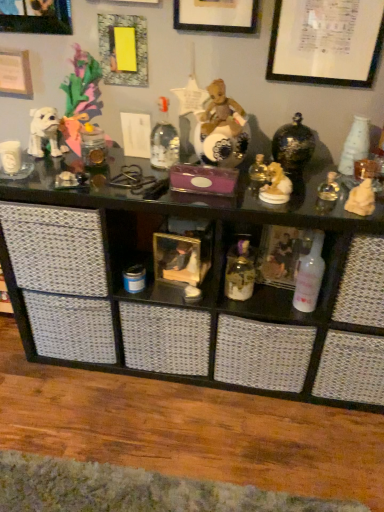
Question: Looking at the image, does white paper at upper left, the 5th picture frame from the right, seem bigger or smaller compared to white glossy bottle at center-right?

Choices:
 (A) big
 (B) small

Answer: (B)

Question: Considering the relative positions of white paper at upper left, the 5th picture frame from the right, and white glossy bottle at center-right in the image provided, is white paper at upper left, the 5th picture frame from the right, to the left or to the right of white glossy bottle at center-right?

Choices:
 (A) right
 (B) left

Answer: (B)

Question: Which is farther from the translucent glass jar at center?

Choices:
 (A) white glossy bottle at center-right
 (B) wooden framed picture at center, which is counted as the 1th shelf, starting from the left
 (C) brushed metal picture frame at upper left, the fourth picture frame when ordered from right to left
 (D) gold ceramic dog at upper right, the 1th toy positioned from the left
 (E) yellow paper at upper left, which is the third picture frame in right-to-left order

Answer: (C)

Question: Based on their relative distances, which object is farther from the brushed metal picture frame at upper left, the fourth picture frame when ordered from right to left?

Choices:
 (A) white paper at upper left, the 1th picture frame in the left-to-right sequence
 (B) white glossy bottle at center-right
 (C) black glass shelf at upper center, positioned as the second shelf in left-to-right order
 (D) wooden framed picture at center, which is counted as the 1th shelf, starting from the left
 (E) translucent glass jar at center

Answer: (B)